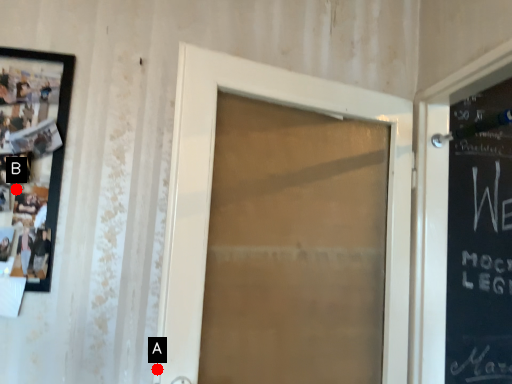
Question: Two points are circled on the image, labeled by A and B beside each circle. Which point is closer to the camera?

Choices:
 (A) A is closer
 (B) B is closer

Answer: (A)